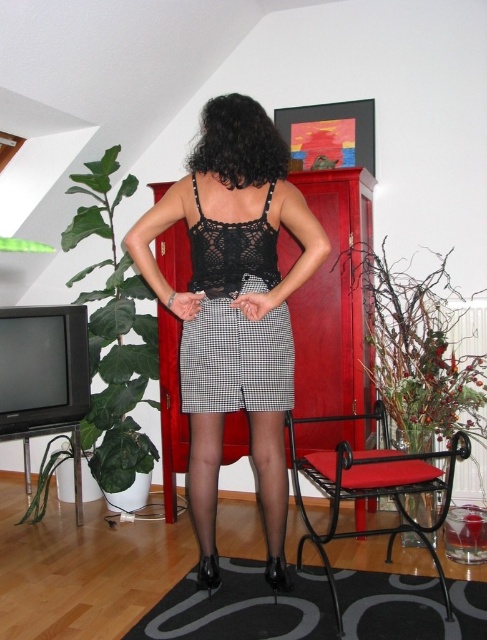
You are an interior designer analyzing the layout of a room. You notice the black mesh top at center. Based on its position, can you determine if it is closer to the left wall or the right wall?

The black mesh top at center is located at the center point of the room, so it is equidistant from both the left and right walls.

You are a fashion stylist helping a client choose an outfit. The client is wearing the black mesh top at center and the black lace dress at center. Which item is positioned lower on her body?

The black mesh top at center is located below the black lace dress at center, so it is positioned lower on her body.

You are a photographer setting up a shoot in this room. You need to ensure that the black lace dress at center is visible above the black metal chair at lower right in the final photo. Based on their heights, is this possible?

The black lace dress at center is taller than the black metal chair at lower right, so yes, it will be visible above the chair in the photo.